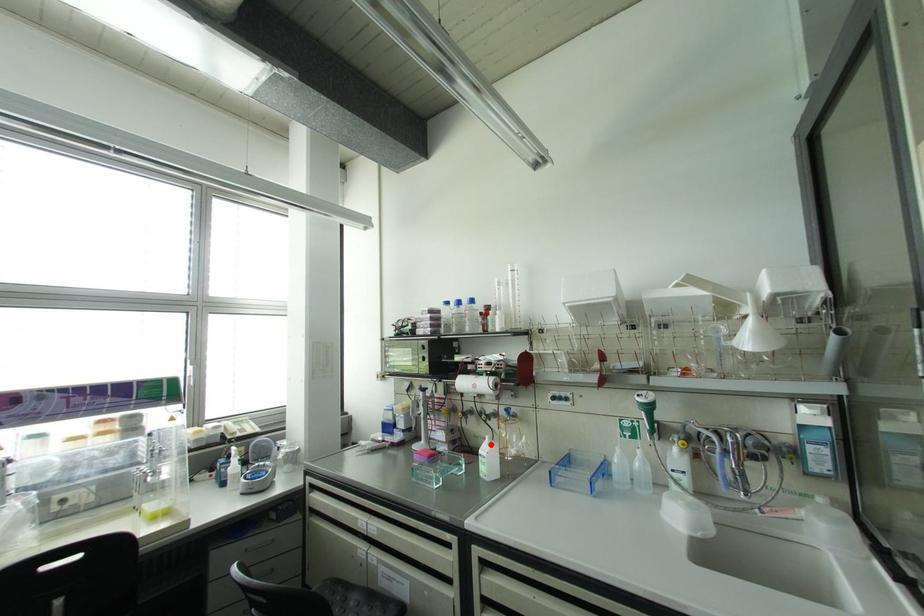
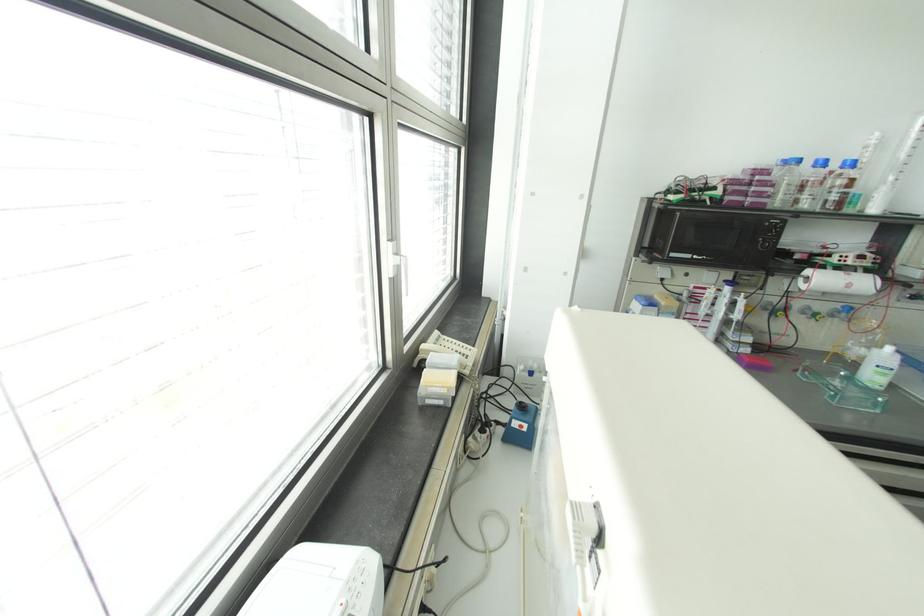
Where in the second image is the point corresponding to the highlighted location from the first image?

(898, 355)